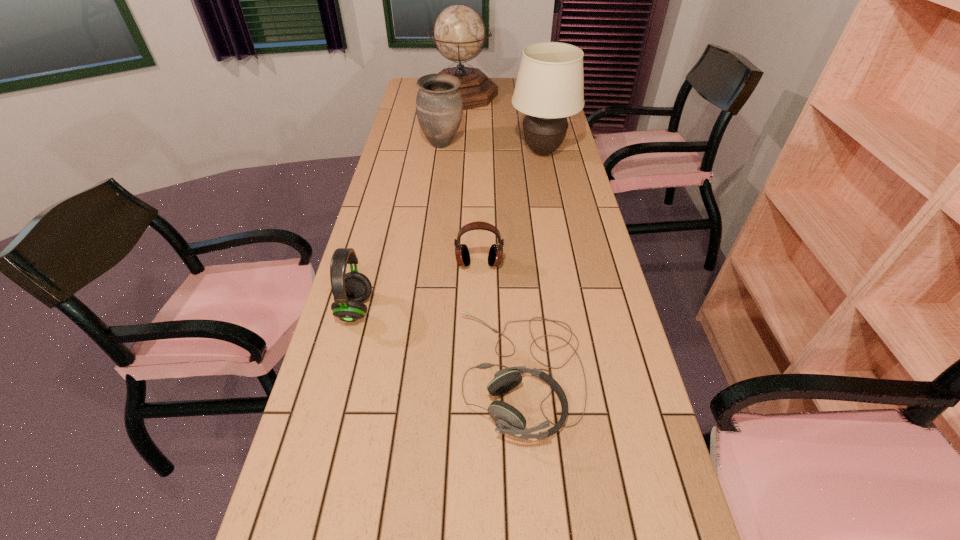
Identify the location of globe. This screenshot has width=960, height=540. (459, 33).

Identify the location of lampshade. This screenshot has height=540, width=960. (549, 88).

Image resolution: width=960 pixels, height=540 pixels. In order to click on the fourth shortest object in this screenshot , I will do `click(439, 107)`.

You are a GUI agent. You are given a task and a screenshot of the screen. Output one action in this format:
    pyautogui.click(x=<x>, y=<y>)
    Task: Click on the leftmost object
    The width and height of the screenshot is (960, 540).
    Given the screenshot: What is the action you would take?
    pyautogui.click(x=350, y=289)

I want to click on the tallest headset, so click(x=350, y=289).

Where is `the second shortest object`? the second shortest object is located at coordinates (495, 255).

The image size is (960, 540). In order to click on the fourth farthest object in this screenshot , I will do click(x=495, y=255).

Locate an element on the screen. the shortest headset is located at coordinates (508, 420).

At what (x,y) coordinates should I click in order to perform the action: click on free point located on the surface of the farthest object. Please return your answer as a coordinate pair (x, y). This screenshot has height=540, width=960. Looking at the image, I should click on (458, 145).

This screenshot has height=540, width=960. In order to click on free region located 0.300m on the left of the lampshade in this screenshot , I will do `click(433, 152)`.